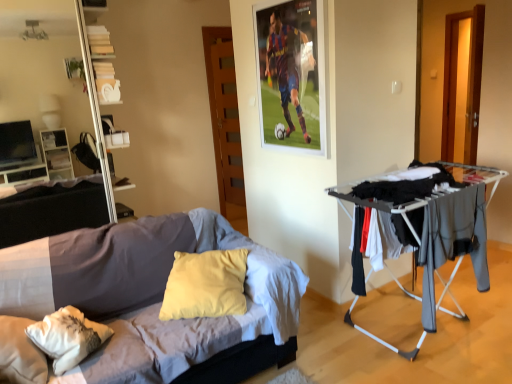
Question: Do you think white glossy bookshelf at upper left is within soft cotton bed at center, or outside of it?

Choices:
 (A) outside
 (B) inside

Answer: (A)

Question: Is white glossy bookshelf at upper left wider or thinner than soft cotton bed at center?

Choices:
 (A) wide
 (B) thin

Answer: (B)

Question: Considering the real-world distances, which object is closest to the white glossy bookshelf at upper left?

Choices:
 (A) white glossy entertainment center at left
 (B) soft cotton bed at center

Answer: (B)

Question: Which object is positioned closest to the white glossy bookshelf at upper left?

Choices:
 (A) white glossy entertainment center at left
 (B) soft cotton bed at center

Answer: (B)